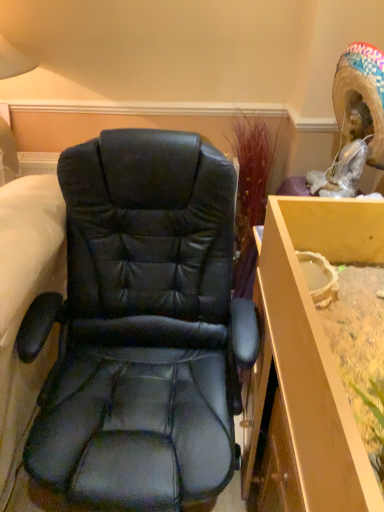
What do you see at coordinates (307, 361) in the screenshot? The image size is (384, 512). I see `wooden vanity at right` at bounding box center [307, 361].

Where is `wooden vanity at right`? The width and height of the screenshot is (384, 512). wooden vanity at right is located at coordinates (307, 361).

Where is `wooden vanity at right`? wooden vanity at right is located at coordinates (307, 361).